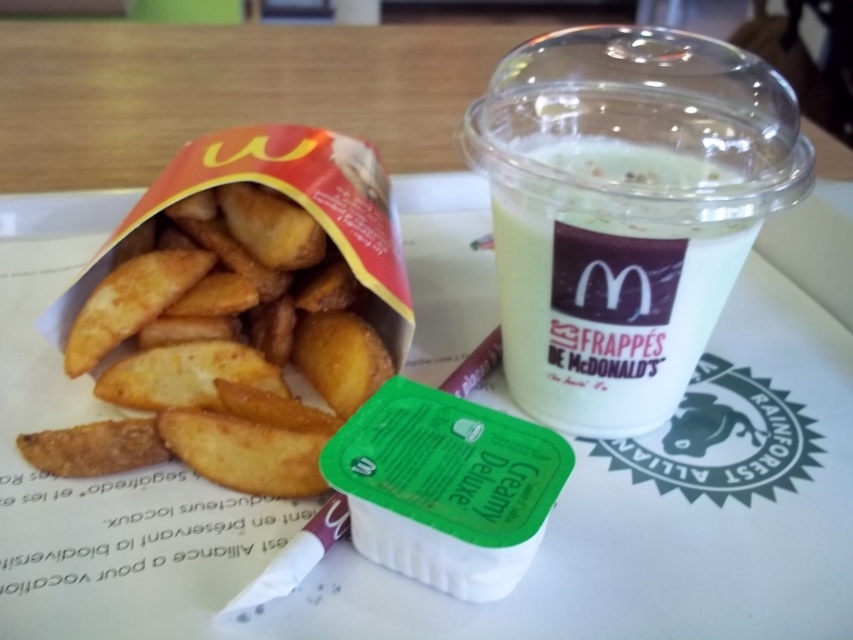
You are at McDonalds and want to grab the golden crispy fries at left. The coordinates of the fries are given as point (219, 356). If your hand is currently at position 0.6, 0.3, which direction should you move your hand to reach the fries?

The point (219, 356) is slightly to the left and above your current hand position at 0.6, 0.3. Move your hand slightly to the left and upwards to reach the golden crispy fries at left.